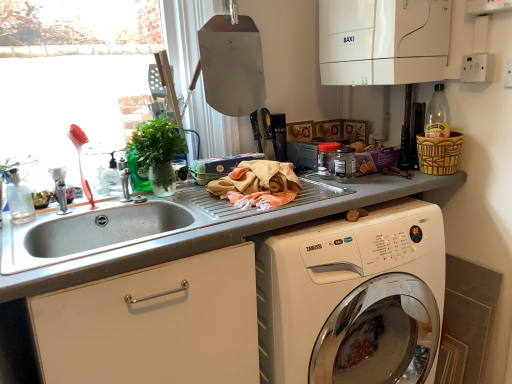
Question: Does smooth gray countertop at center appear on the left side of white glossy washing machine at lower right?

Choices:
 (A) no
 (B) yes

Answer: (B)

Question: Is smooth gray countertop at center directly adjacent to white glossy washing machine at lower right?

Choices:
 (A) no
 (B) yes

Answer: (A)

Question: Is smooth gray countertop at center shorter than white glossy washing machine at lower right?

Choices:
 (A) yes
 (B) no

Answer: (B)

Question: Is smooth gray countertop at center closer to the viewer compared to white glossy washing machine at lower right?

Choices:
 (A) no
 (B) yes

Answer: (B)

Question: Does smooth gray countertop at center appear on the right side of white glossy washing machine at lower right?

Choices:
 (A) no
 (B) yes

Answer: (A)

Question: From a real-world perspective, is smooth gray countertop at center on top of white glossy washing machine at lower right?

Choices:
 (A) no
 (B) yes

Answer: (B)

Question: From a real-world perspective, is transparent plastic jar at center, the 2th appliance in the bottom-to-top sequence, below silver metallic faucet at sink left?

Choices:
 (A) no
 (B) yes

Answer: (B)

Question: From the image's perspective, is transparent plastic jar at center, which is the second appliance from top to bottom, over silver metallic faucet at sink left?

Choices:
 (A) yes
 (B) no

Answer: (A)

Question: Is transparent plastic jar at center, which is the second appliance from top to bottom, taller than silver metallic faucet at sink left?

Choices:
 (A) yes
 (B) no

Answer: (B)

Question: Considering the relative sizes of transparent plastic jar at center, which is the second appliance from top to bottom, and silver metallic faucet at sink left in the image provided, is transparent plastic jar at center, which is the second appliance from top to bottom, smaller than silver metallic faucet at sink left?

Choices:
 (A) no
 (B) yes

Answer: (B)

Question: Is silver metallic faucet at sink left at the back of transparent plastic jar at center, the 2th appliance in the bottom-to-top sequence?

Choices:
 (A) no
 (B) yes

Answer: (A)

Question: Can you confirm if transparent plastic jar at center, which is the second appliance from top to bottom, is thinner than silver metallic faucet at sink left?

Choices:
 (A) yes
 (B) no

Answer: (A)

Question: Is pink plastic brush at left positioned behind green leafy plant at upper left?

Choices:
 (A) yes
 (B) no

Answer: (B)